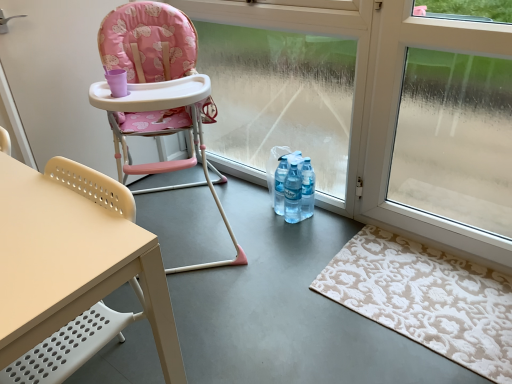
The height and width of the screenshot is (384, 512). I want to click on vacant space that is to the left of translucent plastic bottles at center, so click(251, 212).